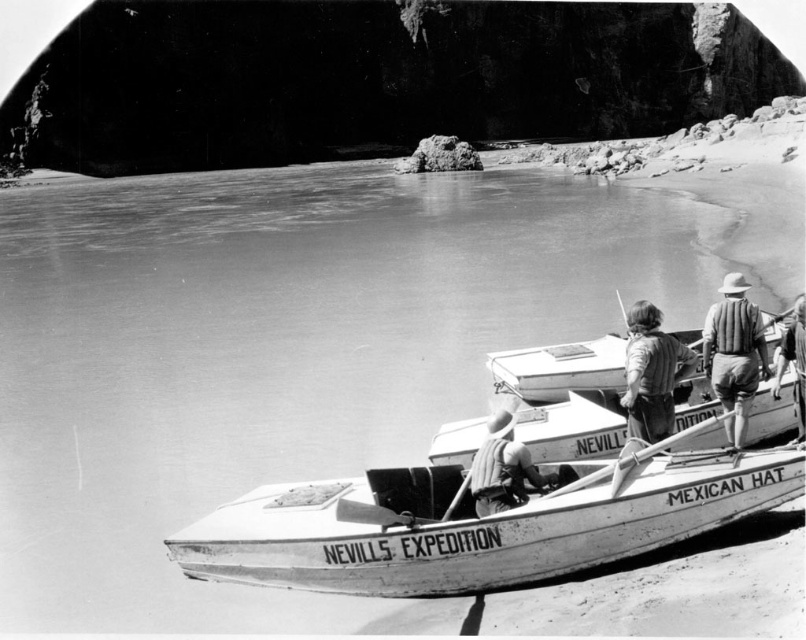
Can you confirm if smooth water at center is wider than striped fabric hat at rear?

Indeed, smooth water at center has a greater width compared to striped fabric hat at rear.

Who is more distant from viewer, (202, 422) or (744, 387)?

The point (202, 422) is behind.

Where is `smooth water at center`? smooth water at center is located at coordinates (300, 352).

Can you confirm if white wood boat at center is bigger than striped fabric hat at rear?

Correct, white wood boat at center is larger in size than striped fabric hat at rear.

Between white wood boat at center and striped fabric hat at rear, which one has more height?

striped fabric hat at rear is taller.

Which is behind, point (420, 547) or point (734, 289)?

Positioned behind is point (734, 289).

Locate an element on the screen. white wood boat at center is located at coordinates (478, 522).

Which of these two, smooth water at center or smooth brown shirt at center, stands taller?

smooth water at center is taller.

Is the position of smooth water at center more distant than that of smooth brown shirt at center?

No, smooth water at center is closer to the viewer.

Locate an element on the screen. Image resolution: width=806 pixels, height=640 pixels. smooth water at center is located at coordinates (300, 352).